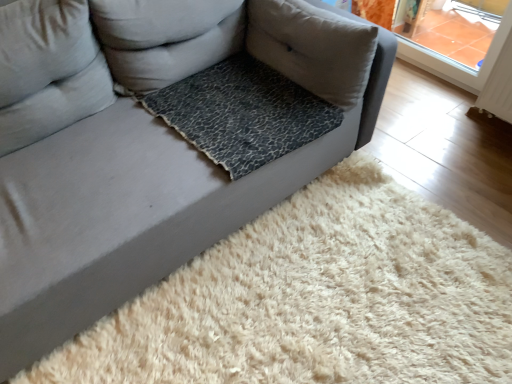
Question: In the image, is leopard print fabric pillow at center, acting as the 1th pillow starting from the right, positioned in front of or behind leopard print fabric at center?

Choices:
 (A) behind
 (B) front

Answer: (A)

Question: In the image, is leopard print fabric pillow at center, placed as the third pillow when sorted from left to right, on the left side or the right side of leopard print fabric at center?

Choices:
 (A) right
 (B) left

Answer: (A)

Question: Which is nearer to the leopard print fabric pillow at center, which is the second pillow in right-to-left order?

Choices:
 (A) light gray fabric pillow at upper left, placed as the 1th pillow when sorted from left to right
 (B) leopard print fabric at center
 (C) leopard print fabric pillow at center, acting as the 1th pillow starting from the right

Answer: (A)

Question: Which object is the closest to the leopard print fabric at center?

Choices:
 (A) light gray fabric pillow at upper left, placed as the 1th pillow when sorted from left to right
 (B) leopard print fabric pillow at center, which is the second pillow in right-to-left order
 (C) leopard print fabric pillow at center, placed as the third pillow when sorted from left to right

Answer: (C)